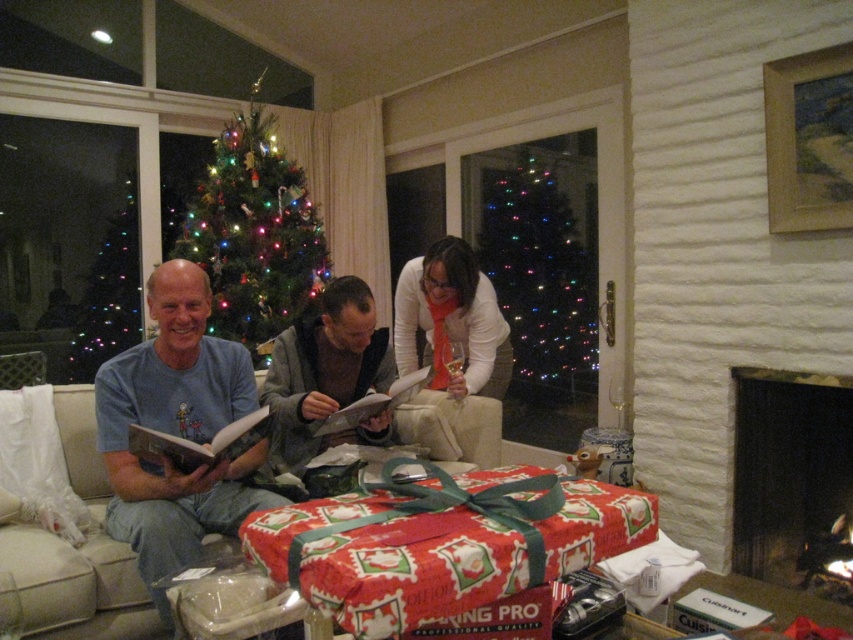
Who is more forward, (575, 164) or (289, 195)?

Point (575, 164)

Does iridescent glass christmas tree at center appear over green matte christmas tree at upper center?

Actually, iridescent glass christmas tree at center is below green matte christmas tree at upper center.

Is point (537, 353) more distant than point (270, 248)?

That is True.

This screenshot has height=640, width=853. I want to click on iridescent glass christmas tree at center, so click(x=540, y=257).

Is the position of black stone fireplace at lower right more distant than that of white matte sweater at center?

No, black stone fireplace at lower right is in front of white matte sweater at center.

Is black stone fireplace at lower right below white matte sweater at center?

Correct, black stone fireplace at lower right is located below white matte sweater at center.

Does point (784, 509) come in front of point (471, 346)?

That is True.

Image resolution: width=853 pixels, height=640 pixels. I want to click on black stone fireplace at lower right, so pyautogui.click(x=790, y=474).

Who is taller, blue cotton shirt at center or gray sweater at center?

blue cotton shirt at center is taller.

Is blue cotton shirt at center positioned before gray sweater at center?

Yes, it is.

Is point (180, 486) farther from viewer compared to point (305, 362)?

No, (180, 486) is in front of (305, 362).

Where is `blue cotton shirt at center`? blue cotton shirt at center is located at coordinates (177, 429).